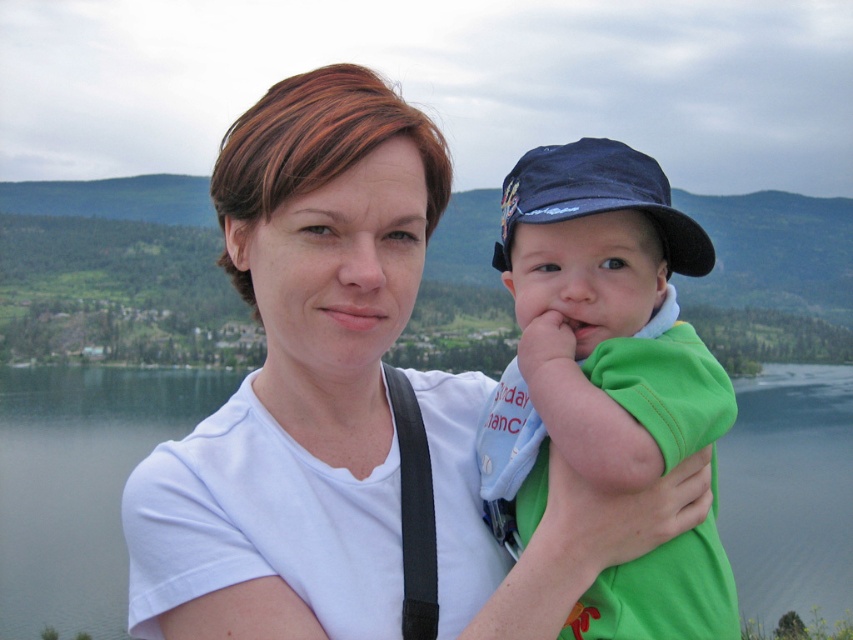
Can you confirm if white cotton shirt at center is positioned above green cotton shirt at center?

Actually, white cotton shirt at center is below green cotton shirt at center.

Can you confirm if white cotton shirt at center is smaller than green cotton shirt at center?

No, white cotton shirt at center is not smaller than green cotton shirt at center.

Is point (440, 448) farther from camera compared to point (534, 301)?

Yes, point (440, 448) is behind point (534, 301).

Find the location of a particular element. The width and height of the screenshot is (853, 640). white cotton shirt at center is located at coordinates (299, 378).

In the scene shown: Can you confirm if green cotton shirt at center is taller than transparent water at center?

Incorrect, green cotton shirt at center's height is not larger of transparent water at center's.

Does point (611, 465) lie in front of point (134, 429)?

Yes, it is.

Which is behind, point (502, 449) or point (735, 452)?

Positioned behind is point (735, 452).

Identify the location of green cotton shirt at center. (596, 330).

Where is `transparent water at center`? transparent water at center is located at coordinates (80, 484).

Which is below, transparent water at center or dark blue fabric baseball cap at center?

Positioned lower is transparent water at center.

Where is `transparent water at center`? Image resolution: width=853 pixels, height=640 pixels. transparent water at center is located at coordinates (80, 484).